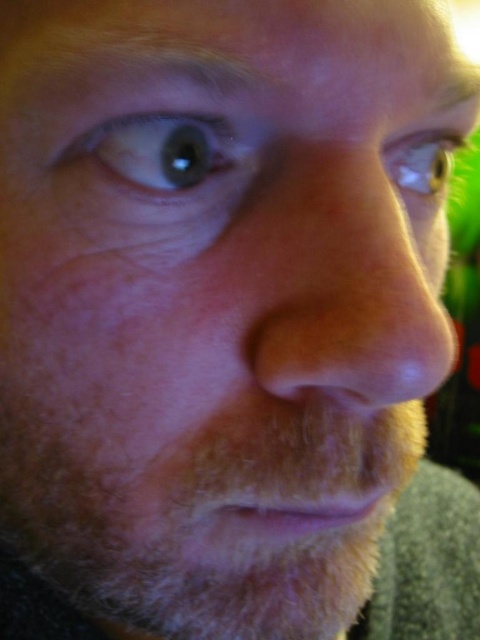
You are a photographer trying to adjust the lighting for a portrait. You notice the blue glossy eye at upper left and the green glossy eye at upper right. Which eye is closer to the camera based on their size in the image?

The blue glossy eye at upper left is shorter than the green glossy eye at upper right, so the green glossy eye at upper right is closer to the camera because objects closer to the camera appear larger.

You are a photographer adjusting the focus on a camera. You notice two glossy reflections in the subject face, a blue glossy eye at upper left and a green glossy eye at upper right. Which reflection is larger?

The green glossy eye at upper right is larger than the blue glossy eye at upper left.

You are a photographer adjusting the focus on a camera. You notice two eyes in the viewfinder, the blue glossy eye at upper left and the green glossy eye at upper right. Which eye should you focus on if you want to ensure both are in focus, considering their positions and sizes?

The blue glossy eye at upper left might be wider than the green glossy eye at upper right, so focusing on the wider blue glossy eye at upper left could help ensure both are in focus.